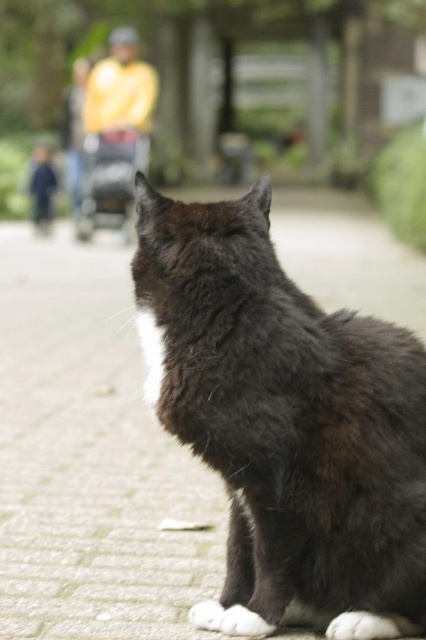
Looking at this image, which is more to the left, black fur cat at center or yellow fabric jacket at upper left?

yellow fabric jacket at upper left

Does black fur cat at center appear under yellow fabric jacket at upper left?

Yes.

Is point (423, 406) positioned before point (103, 157)?

Yes, it is in front of point (103, 157).

At what (x,y) coordinates should I click in order to perform the action: click on black fur cat at center. Please return your answer as a coordinate pair (x, y). Image resolution: width=426 pixels, height=640 pixels. Looking at the image, I should click on (285, 422).